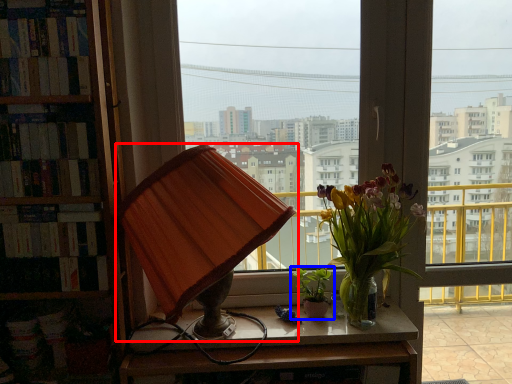
Question: Which object appears farthest to the camera in this image, lamp (highlighted by a red box) or houseplant (highlighted by a blue box)?

Choices:
 (A) lamp
 (B) houseplant

Answer: (B)